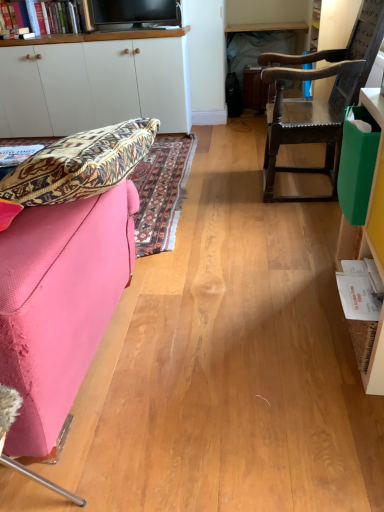
The image size is (384, 512). I want to click on unoccupied space behind green plastic bag at right, arranged as the first cabinetry when viewed from the right, so click(x=296, y=249).